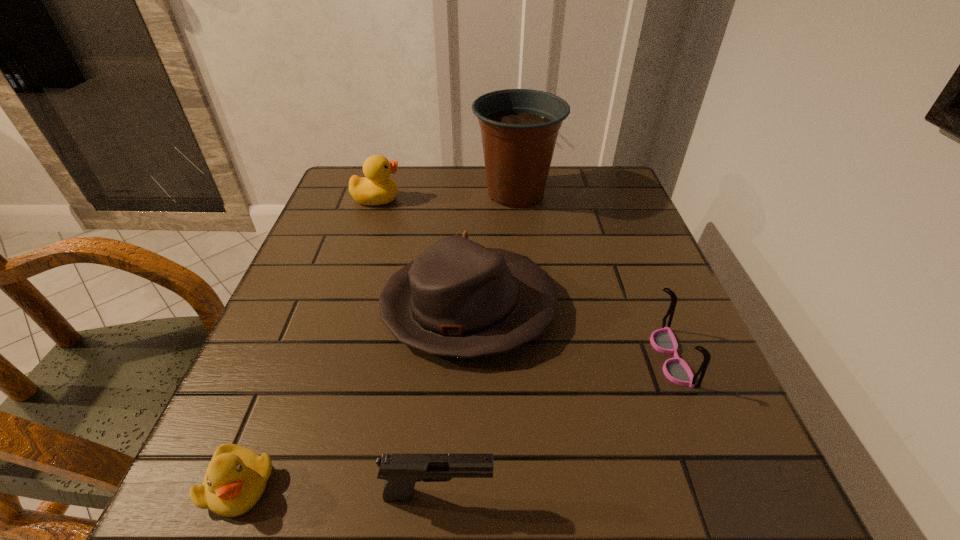
Find the location of a particular element. Image resolution: width=960 pixels, height=540 pixels. vacant area situated aim along the barrel of the pistol is located at coordinates (727, 494).

The image size is (960, 540). I want to click on flowerpot that is at the far edge, so click(x=519, y=127).

At what (x,y) coordinates should I click in order to perform the action: click on duck that is positioned at the far edge. Please return your answer as a coordinate pair (x, y). The image size is (960, 540). Looking at the image, I should click on (376, 188).

At what (x,y) coordinates should I click in order to perform the action: click on pistol present at the near edge. Please return your answer as a coordinate pair (x, y). This screenshot has height=540, width=960. Looking at the image, I should click on (401, 472).

This screenshot has height=540, width=960. Identify the location of duckling located in the near edge section of the desktop. (236, 477).

The height and width of the screenshot is (540, 960). I want to click on duck that is at the left edge, so click(376, 188).

Image resolution: width=960 pixels, height=540 pixels. I want to click on duckling at the left edge, so click(x=236, y=477).

Find the location of `object present at the right edge`. object present at the right edge is located at coordinates (663, 340).

At what (x,y) coordinates should I click in order to perform the action: click on object present at the far left corner. Please return your answer as a coordinate pair (x, y). The width and height of the screenshot is (960, 540). Looking at the image, I should click on (376, 188).

Identify the location of object present at the near left corner. (236, 477).